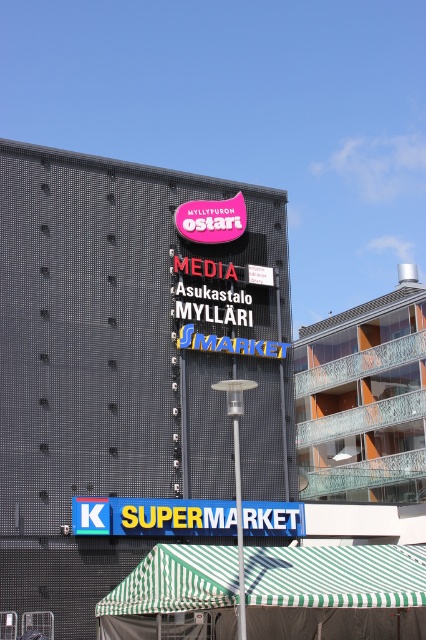
Question: Which of the following is the closest to the observer?

Choices:
 (A) (175, 221)
 (B) (391, 406)
 (C) (144, 557)

Answer: (C)

Question: Does orange glass balcony at upper right appear on the left side of blue plastic sign at bottom?

Choices:
 (A) yes
 (B) no

Answer: (B)

Question: Which of the following is the farthest from the observer?

Choices:
 (A) pink fabric sign at upper center
 (B) green striped canopy at lower center
 (C) orange glass balcony at upper right
 (D) blue plastic sign at bottom

Answer: (C)

Question: Does blue plastic sign at bottom have a lesser width compared to pink fabric sign at upper center?

Choices:
 (A) no
 (B) yes

Answer: (A)

Question: Estimate the real-world distances between objects in this image. Which object is closer to the green striped canopy at lower center?

Choices:
 (A) pink fabric sign at upper center
 (B) orange glass balcony at upper right
 (C) blue plastic sign at bottom

Answer: (C)

Question: Does green striped canopy at lower center have a lesser width compared to orange glass balcony at upper right?

Choices:
 (A) yes
 (B) no

Answer: (A)